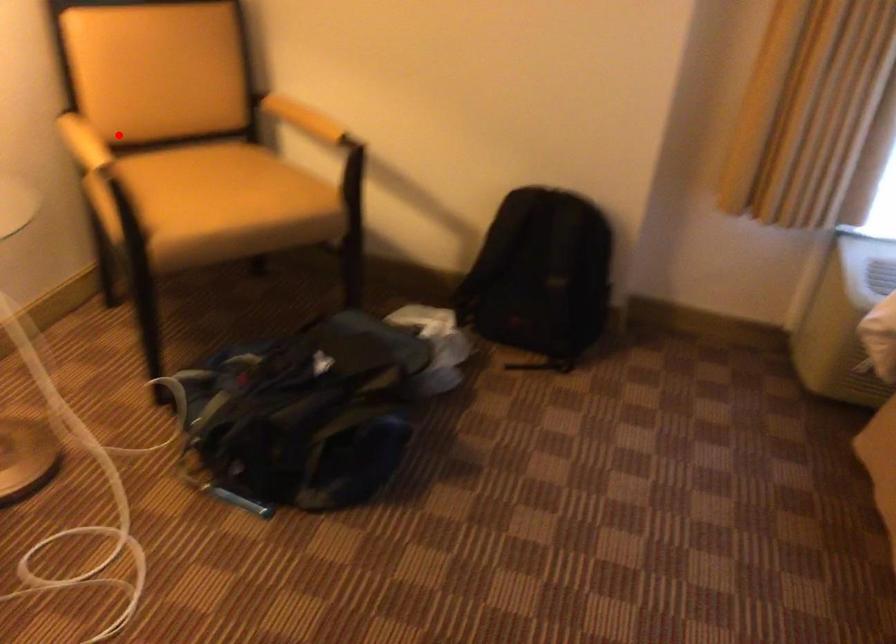
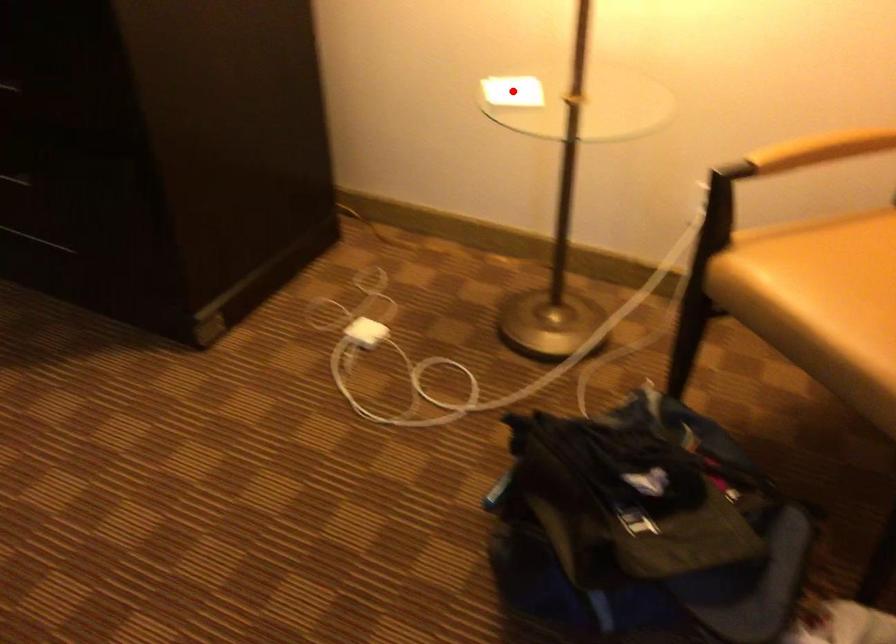
I am providing you with two images of the same scene from different viewpoints. A red point is marked on the first image and another point is marked on the second image. Do the highlighted points in image1 and image2 indicate the same real-world spot?

No